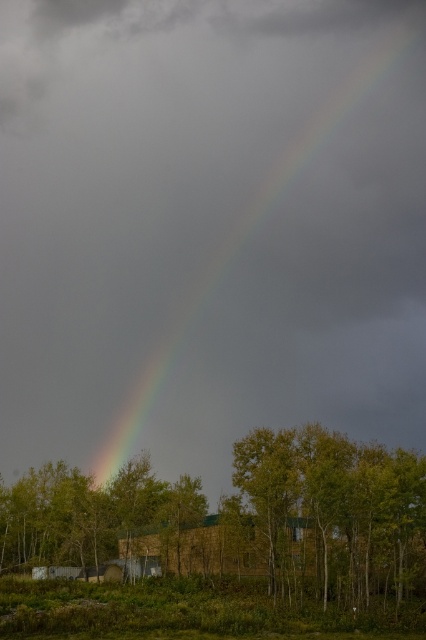
Question: Which point is closer to the camera?

Choices:
 (A) rainbow at upper center
 (B) green leafy tree at lower center
 (C) brown wooden hut at center

Answer: (B)

Question: Is the position of rainbow at upper center less distant than that of brown wooden hut at center?

Choices:
 (A) no
 (B) yes

Answer: (A)

Question: Which point is farther from the camera taking this photo?

Choices:
 (A) (132, 400)
 (B) (51, 582)

Answer: (A)

Question: Which of the following is the farthest from the observer?

Choices:
 (A) (399, 547)
 (B) (241, 524)

Answer: (B)

Question: Does green leafy tree at lower center lie behind brown wooden hut at center?

Choices:
 (A) yes
 (B) no

Answer: (B)

Question: Can you confirm if rainbow at upper center is bigger than brown wooden hut at center?

Choices:
 (A) no
 (B) yes

Answer: (B)